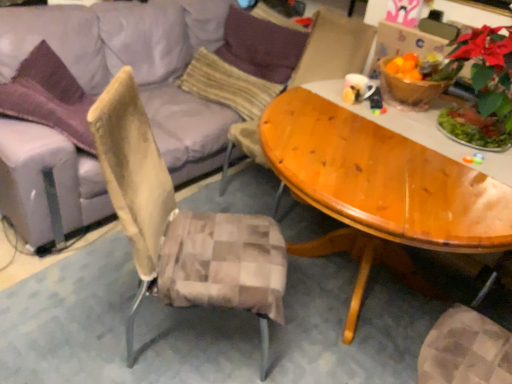
Question: Does light gray fabric couch at upper left lie behind green matte poinsettia at upper right?

Choices:
 (A) no
 (B) yes

Answer: (A)

Question: Can green matte poinsettia at upper right be found inside light gray fabric couch at upper left?

Choices:
 (A) no
 (B) yes

Answer: (A)

Question: Can you confirm if light gray fabric couch at upper left is taller than green matte poinsettia at upper right?

Choices:
 (A) yes
 (B) no

Answer: (A)

Question: Considering the relative sizes of light gray fabric couch at upper left and green matte poinsettia at upper right in the image provided, is light gray fabric couch at upper left wider than green matte poinsettia at upper right?

Choices:
 (A) yes
 (B) no

Answer: (A)

Question: From the image's perspective, is light gray fabric couch at upper left above green matte poinsettia at upper right?

Choices:
 (A) no
 (B) yes

Answer: (A)

Question: Could you tell me if light gray fabric couch at upper left is facing green matte poinsettia at upper right?

Choices:
 (A) yes
 (B) no

Answer: (A)

Question: Are green matte poinsettia at upper right and light gray fabric couch at upper left making contact?

Choices:
 (A) no
 (B) yes

Answer: (A)

Question: Is green matte poinsettia at upper right at the right side of light gray fabric couch at upper left?

Choices:
 (A) no
 (B) yes

Answer: (B)

Question: From a real-world perspective, does green matte poinsettia at upper right stand above light gray fabric couch at upper left?

Choices:
 (A) no
 (B) yes

Answer: (B)

Question: From a real-world perspective, does green matte poinsettia at upper right sit lower than light gray fabric couch at upper left?

Choices:
 (A) no
 (B) yes

Answer: (A)

Question: Considering the relative sizes of green matte poinsettia at upper right and light gray fabric couch at upper left in the image provided, is green matte poinsettia at upper right taller than light gray fabric couch at upper left?

Choices:
 (A) no
 (B) yes

Answer: (A)

Question: From the image's perspective, is green matte poinsettia at upper right located beneath light gray fabric couch at upper left?

Choices:
 (A) yes
 (B) no

Answer: (B)

Question: From the image's perspective, is purple fabric pillow at upper center, which ranks as the 1th pillow in top-to-bottom order, above light gray fabric couch at upper left?

Choices:
 (A) yes
 (B) no

Answer: (A)